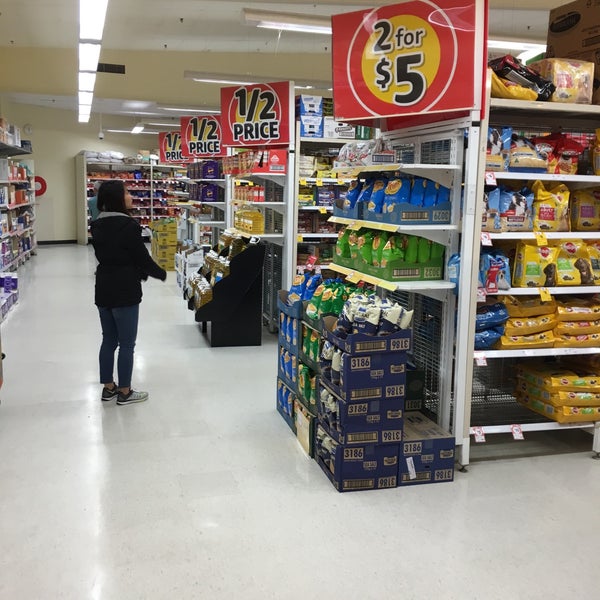
This screenshot has height=600, width=600. Identify the location of flourexcent ceiling light. (85, 20), (85, 57), (82, 87), (82, 97), (82, 111), (291, 27), (506, 45).